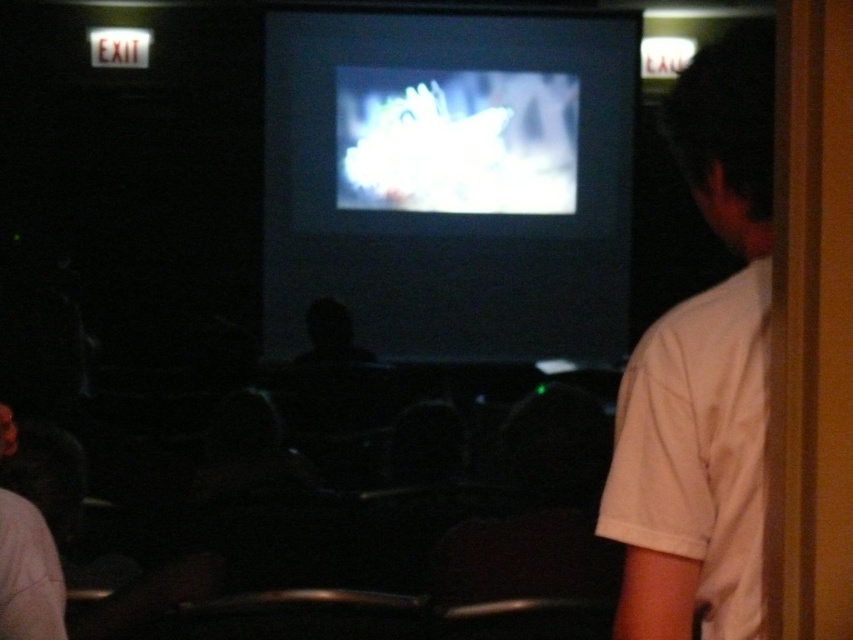
Question: Among these points, which one is farthest from the camera?

Choices:
 (A) (666, 362)
 (B) (355, 195)

Answer: (B)

Question: Does matte black screen at center appear on the left side of white cotton shirt at right?

Choices:
 (A) no
 (B) yes

Answer: (B)

Question: Where is matte black screen at center located in relation to white cotton shirt at right in the image?

Choices:
 (A) below
 (B) above

Answer: (B)

Question: Is matte black screen at center to the left of white cotton shirt at right from the viewer's perspective?

Choices:
 (A) no
 (B) yes

Answer: (B)